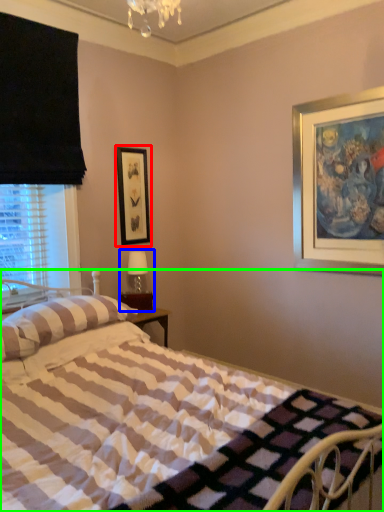
Question: Which object is the closest to the picture frame (highlighted by a red box)? Choose among these: table lamp (highlighted by a blue box) or bed (highlighted by a green box).

Choices:
 (A) table lamp
 (B) bed

Answer: (A)